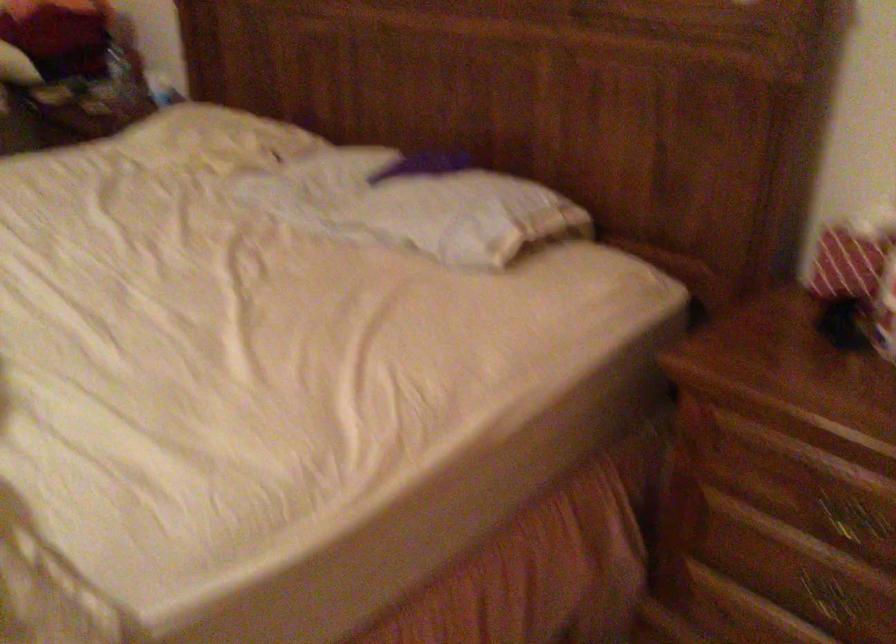
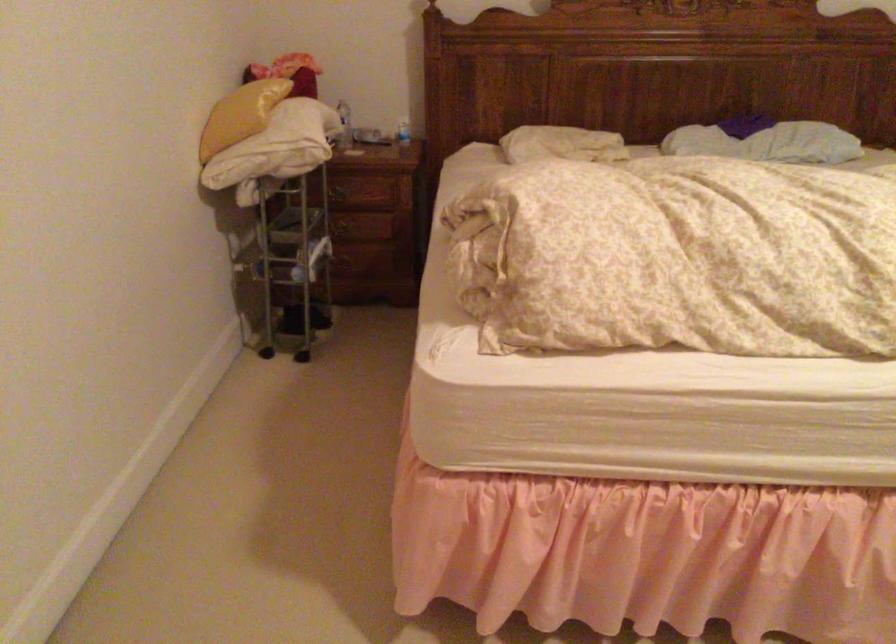
In the second image, find the point that corresponds to (195,140) in the first image.

(561, 144)